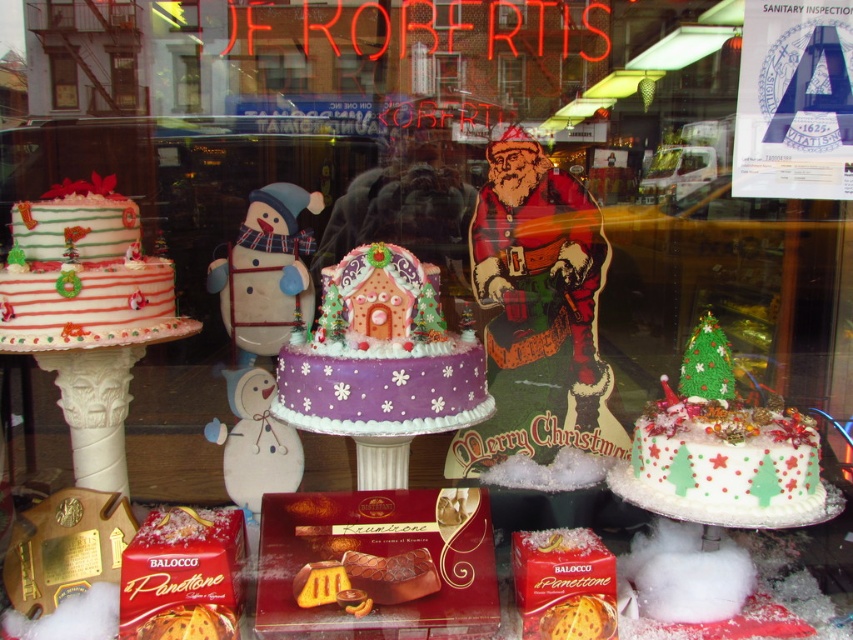
Question: Which point is closer to the camera?

Choices:
 (A) coord(120,227)
 (B) coord(802,460)
 (C) coord(195,86)
 (D) coord(247,442)

Answer: (B)

Question: Considering the relative positions of white frosted cake with green and red decorations at center and clear glass window at center in the image provided, where is white frosted cake with green and red decorations at center located with respect to clear glass window at center?

Choices:
 (A) above
 (B) below

Answer: (B)

Question: Based on their relative distances, which object is nearer to the plush fabric snowman at center?

Choices:
 (A) white fabric snowman at center
 (B) matte white snowman at center
 (C) matte glass window at center

Answer: (A)

Question: Does clear glass window at center have a smaller size compared to matte white snowman at center?

Choices:
 (A) no
 (B) yes

Answer: (A)

Question: Does plush fabric snowman at center have a smaller size compared to white fabric snowman at center?

Choices:
 (A) yes
 (B) no

Answer: (A)

Question: Which object is closer to the camera taking this photo?

Choices:
 (A) clear glass window at center
 (B) matte white snowman at center
 (C) white striped cake at left

Answer: (C)